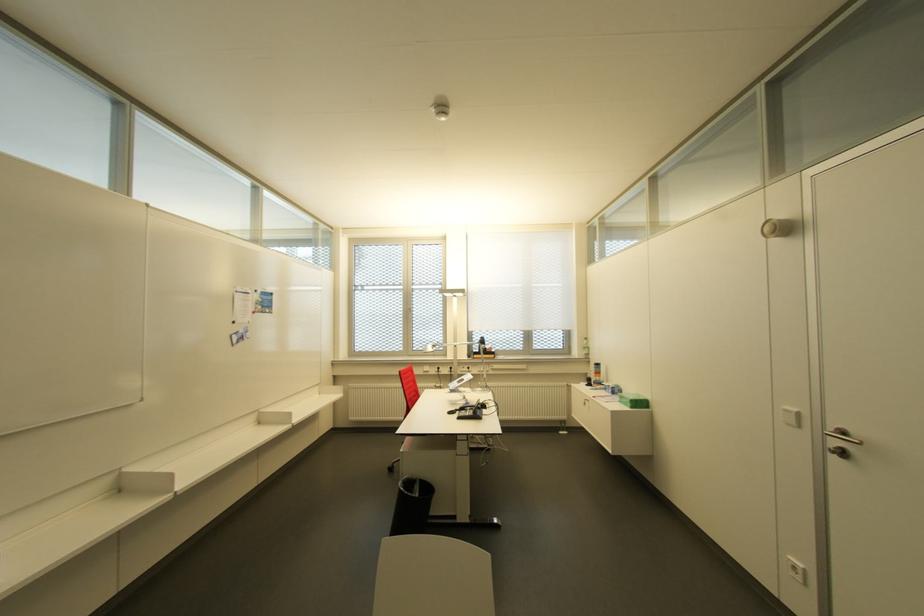
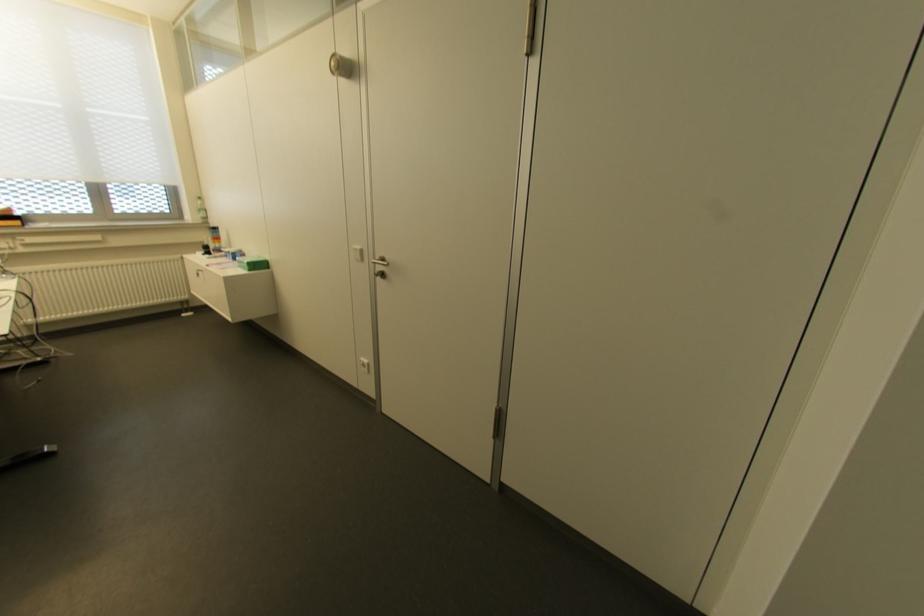
The point at (586,355) is marked in the first image. Where is the corresponding point in the second image?

(204, 217)